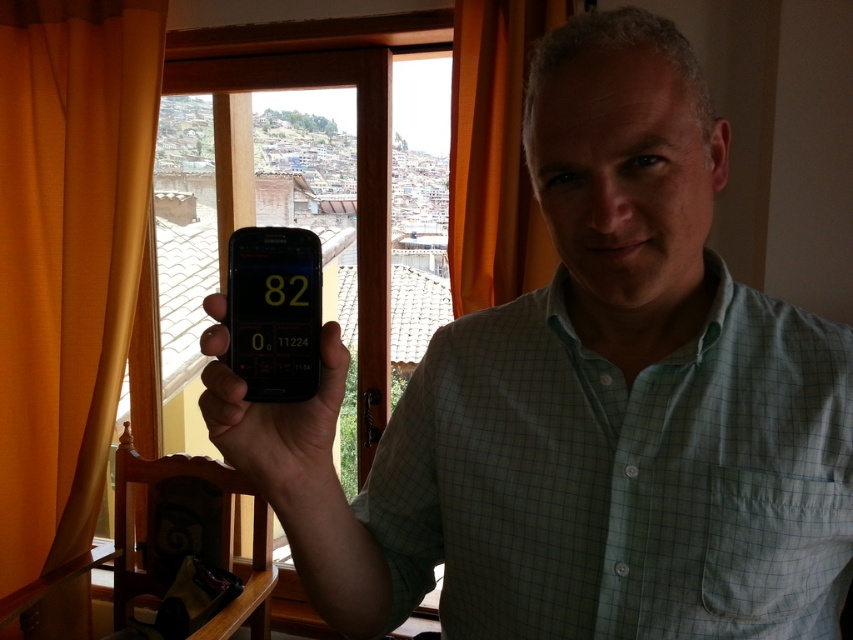
You are designing a new interior layout and need to know the relative sizes of the orange satin curtain at upper right and the matte black phone at center. Which object is wider?

The orange satin curtain at upper right is wider than the matte black phone at center.

You are a fashion designer observing the image. You need to decide whether the green checkered shirt at center can be seen from the side opposite to the matte black phone at center. Based on their positions, is this possible?

The green checkered shirt at center is positioned on the right side of the matte black phone at center. Since they are positioned side by side, the green checkered shirt at center would be visible from the opposite side of the matte black phone at center as they are adjacent to each other.